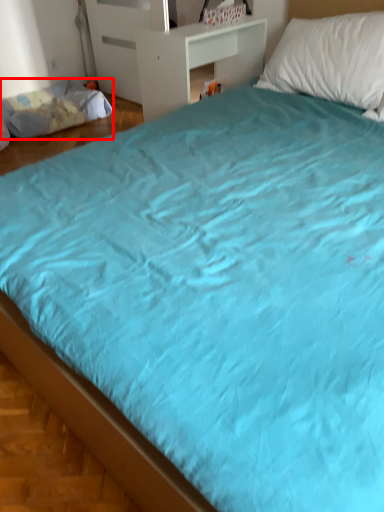
Question: From the image's perspective, where is mattress (annotated by the red box) located relative to table?

Choices:
 (A) above
 (B) below

Answer: (A)